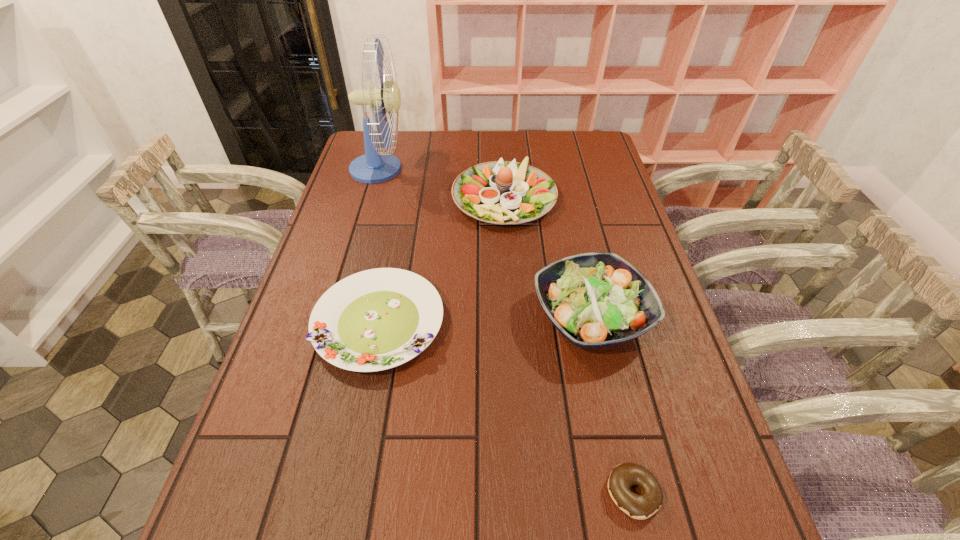
This screenshot has width=960, height=540. I want to click on vacant area in the image that satisfies the following two spatial constraints: 1. on the back side of the nearest object; 2. at the front of the tallest object where the blades are visible, so click(x=560, y=169).

Image resolution: width=960 pixels, height=540 pixels. I want to click on vacant space that satisfies the following two spatial constraints: 1. on the back side of the doughnut; 2. at the front of the fan where the blades are visible, so click(x=560, y=169).

Locate an element on the screen. free point that satisfies the following two spatial constraints: 1. at the front of the tallest object where the blades are visible; 2. on the right side of the nearest object is located at coordinates (286, 493).

This screenshot has height=540, width=960. Find the location of `free location that satisfies the following two spatial constraints: 1. on the back side of the shortest object; 2. at the front of the tallest object where the blades are visible`. free location that satisfies the following two spatial constraints: 1. on the back side of the shortest object; 2. at the front of the tallest object where the blades are visible is located at coordinates (560, 169).

Locate an element on the screen. This screenshot has height=540, width=960. free space in the image that satisfies the following two spatial constraints: 1. at the front of the tallest object where the blades are visible; 2. on the back side of the farthest salad plate is located at coordinates (372, 197).

At what (x,y) coordinates should I click in order to perform the action: click on vacant point that satisfies the following two spatial constraints: 1. at the front of the fan where the blades are visible; 2. on the right side of the farthest salad plate. Please return your answer as a coordinate pair (x, y). Looking at the image, I should click on (372, 197).

Where is `blank space that satisfies the following two spatial constraints: 1. at the front of the shortest salad plate where the blades are visible; 2. on the left side of the tallest object`? Image resolution: width=960 pixels, height=540 pixels. blank space that satisfies the following two spatial constraints: 1. at the front of the shortest salad plate where the blades are visible; 2. on the left side of the tallest object is located at coordinates (335, 323).

Image resolution: width=960 pixels, height=540 pixels. Identify the location of free location that satisfies the following two spatial constraints: 1. at the front of the fan where the blades are visible; 2. on the left side of the farthest salad plate. (372, 197).